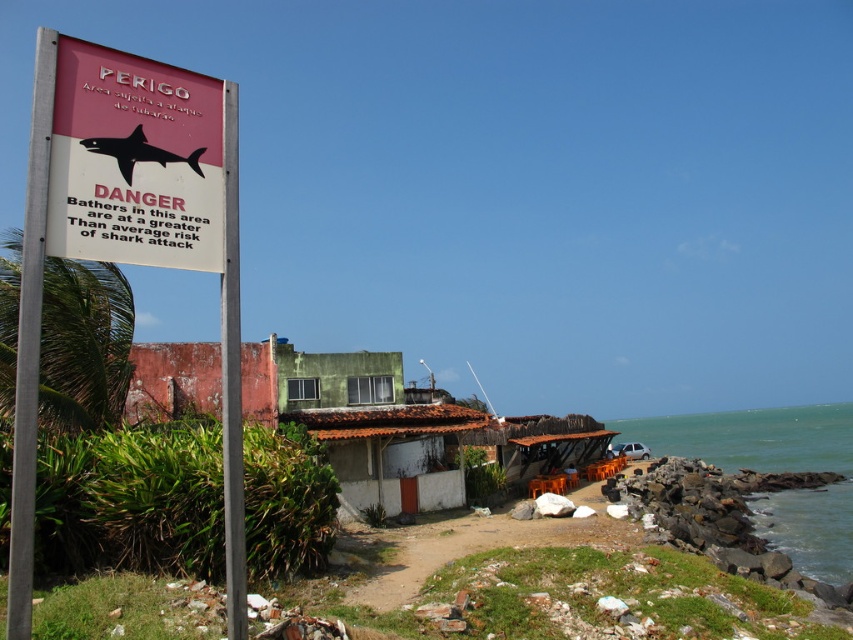
Between silver metallic pole at left and metallic signpost at left, which one is positioned lower?

metallic signpost at left is lower down.

Does silver metallic pole at left have a greater width compared to metallic signpost at left?

Yes.

Is point (18, 412) in front of point (228, 540)?

Yes, it is.

Where is `silver metallic pole at left`? silver metallic pole at left is located at coordinates (28, 340).

Who is more forward, (218, 84) or (660, 419)?

Point (218, 84) is more forward.

Who is shorter, metallic signboard at left or green water at lower right?

metallic signboard at left is shorter.

Where is `metallic signboard at left`? The height and width of the screenshot is (640, 853). metallic signboard at left is located at coordinates (126, 236).

Who is shorter, green water at lower right or silver metallic pole at left?

With less height is silver metallic pole at left.

Is green water at lower right to the left of silver metallic pole at left from the viewer's perspective?

Incorrect, green water at lower right is not on the left side of silver metallic pole at left.

The width and height of the screenshot is (853, 640). What do you see at coordinates (775, 472) in the screenshot?
I see `green water at lower right` at bounding box center [775, 472].

Find the location of a particular element. The height and width of the screenshot is (640, 853). green water at lower right is located at coordinates (775, 472).